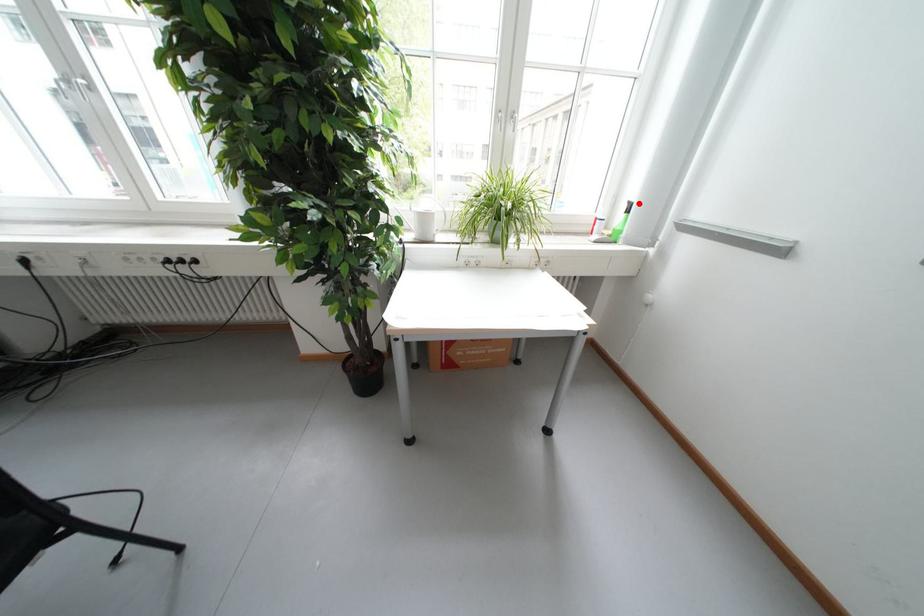
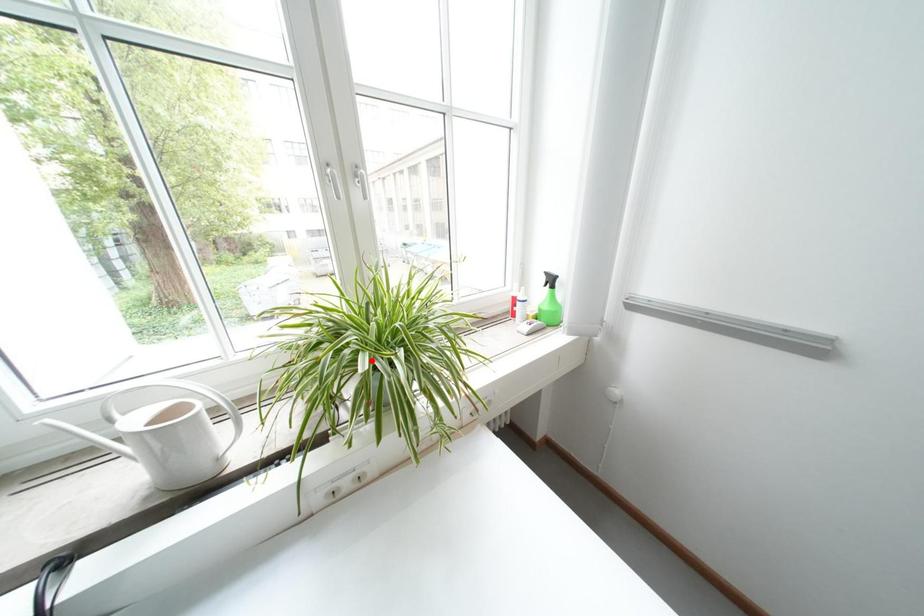
I am providing you with two images of the same scene from different viewpoints. A red point is marked on the first image and another point is marked on the second image. Is the red point in image1 aligned with the point shown in image2?

No